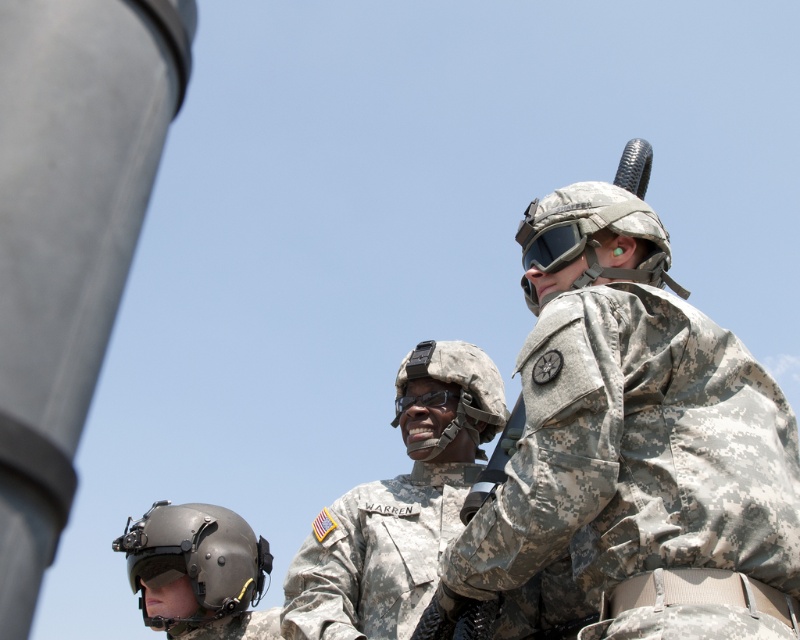
You are a photographer positioned at the back of the scene. You want to take a photo of the camouflage uniform at center without the smooth gray pole at left blocking the view. Is this possible?

The smooth gray pole at left is shorter than the camouflage uniform at center. Since the pole is shorter, it might not block the entire view of the camouflage uniform at center, so it is possible to take a photo without the pole blocking the view.

Based on the scene description, which helmet is positioned lower in the image, the matte black helmet at lower left or the camouflage fabric helmet at upper right?

The matte black helmet at lower left is positioned lower in the image than the camouflage fabric helmet at upper right.

You are a drone operator trying to locate the smooth gray pole at left in a military training area. The GPS coordinates of the pole are given as a point with x 0.373 and y 0.086. If your current position is at the origin point, which direction should you move your drone to reach the pole?

The smooth gray pole at left is located at coordinates x 0.373 and y 0.086. Since the pole has a positive x and y value, you should move your drone east and north to reach it.